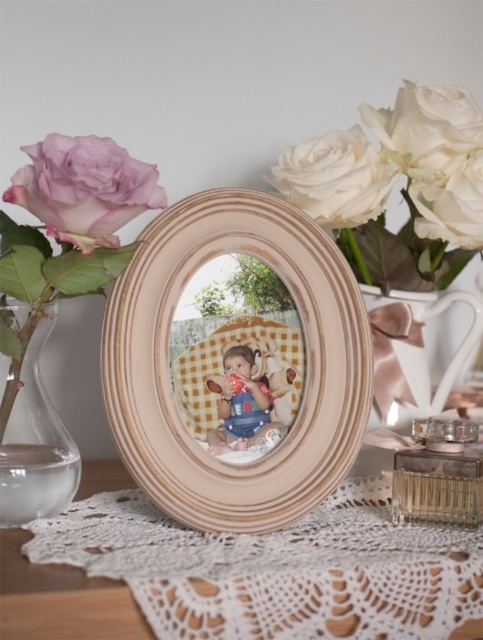
Question: Which object is closer to the camera taking this photo?

Choices:
 (A) white matte rose at upper right
 (B) wooden frame at center

Answer: (B)

Question: Estimate the real-world distances between objects in this image. Which object is closer to the clear glass perfume at center?

Choices:
 (A) matte blue jumpsuit at center
 (B) white matte rose at upper right

Answer: (A)

Question: From the image, what is the correct spatial relationship of pink matte rose at upper left in relation to matte blue jumpsuit at center?

Choices:
 (A) above
 (B) below

Answer: (A)

Question: Does wooden frame at center appear over clear glass perfume at center?

Choices:
 (A) yes
 (B) no

Answer: (A)

Question: Which point appears closest to the camera in this image?

Choices:
 (A) (225, 410)
 (B) (391, 362)

Answer: (A)

Question: Does white lace doily at center have a smaller size compared to white porcelain vase at upper right?

Choices:
 (A) yes
 (B) no

Answer: (B)